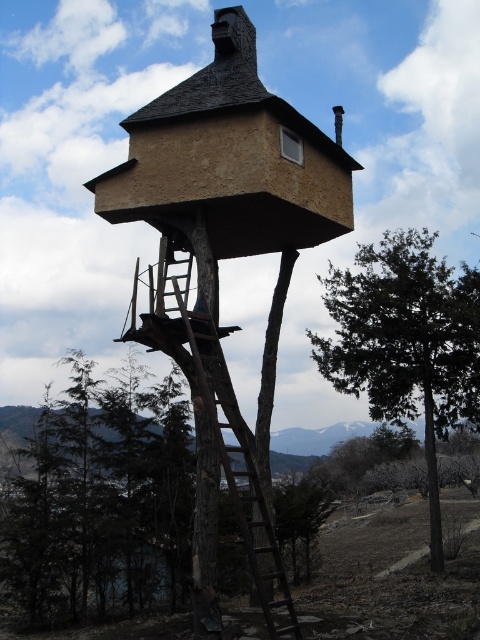
Question: Which of the following is the closest to the observer?

Choices:
 (A) (271, 616)
 (B) (374, 419)

Answer: (A)

Question: Is green leafy tree at center thinner than brown wooden ladder at center?

Choices:
 (A) no
 (B) yes

Answer: (A)

Question: Can you confirm if green leafy tree at center is smaller than brown wooden ladder at center?

Choices:
 (A) yes
 (B) no

Answer: (B)

Question: Can you confirm if green leafy tree at center is thinner than brown wooden ladder at center?

Choices:
 (A) yes
 (B) no

Answer: (B)

Question: Which point is farther from the camera taking this photo?

Choices:
 (A) [214, 406]
 (B) [408, 230]

Answer: (B)

Question: Which point is closer to the camera?

Choices:
 (A) (404, 236)
 (B) (283, 580)

Answer: (B)